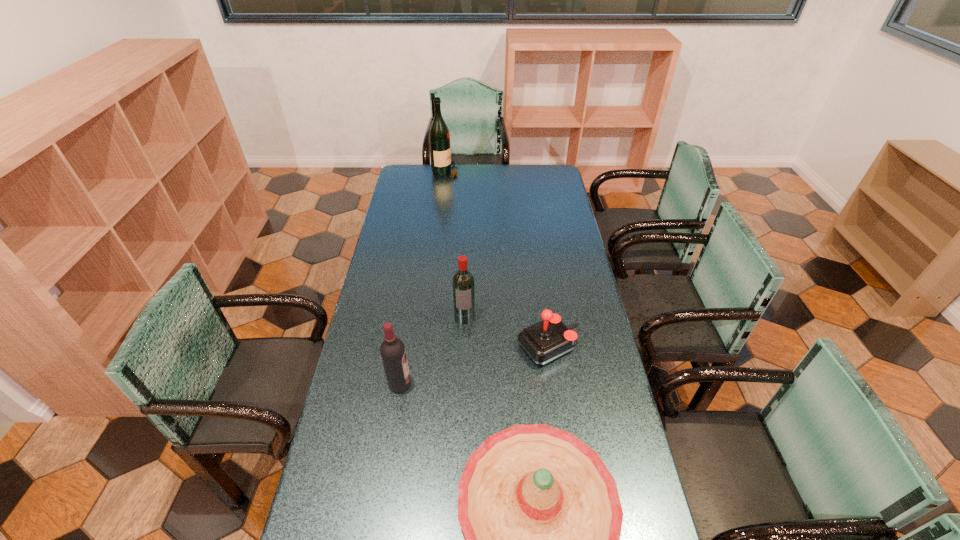
You are a GUI agent. You are given a task and a screenshot of the screen. Output one action in this format:
    pyautogui.click(x=<x>, y=<y>)
    Task: Click on the vacant space that is in between the joystick and the fourth nearest object
    The image size is (960, 540).
    Given the screenshot: What is the action you would take?
    pyautogui.click(x=507, y=332)

Image resolution: width=960 pixels, height=540 pixels. In order to click on free space between the second farthest object and the joystick in this screenshot , I will do `click(507, 332)`.

The height and width of the screenshot is (540, 960). Identify the location of empty space that is in between the joystick and the rightmost wine bottle. (507, 332).

Locate an element on the screen. free spot between the nearest wine bottle and the farthest object is located at coordinates (423, 278).

Identify the location of vacant region between the nearest wine bottle and the farthest object. The width and height of the screenshot is (960, 540). pos(423,278).

I want to click on free space that is in between the nearest wine bottle and the second nearest wine bottle, so click(x=432, y=350).

Choose which object is the second nearest neighbor to the nearest object. Please provide its 2D coordinates. Your answer should be formatted as a tuple, i.e. [(x, y)], where the tuple contains the x and y coordinates of a point satisfying the conditions above.

[(548, 339)]

Identify which object is the third nearest to the fourth farthest object. Please provide its 2D coordinates. Your answer should be formatted as a tuple, i.e. [(x, y)], where the tuple contains the x and y coordinates of a point satisfying the conditions above.

[(548, 339)]

Identify which wine bottle is the second nearest to the rightmost wine bottle. Please provide its 2D coordinates. Your answer should be formatted as a tuple, i.e. [(x, y)], where the tuple contains the x and y coordinates of a point satisfying the conditions above.

[(439, 137)]

Image resolution: width=960 pixels, height=540 pixels. What are the coordinates of `the second closest wine bottle relative to the rightmost wine bottle` in the screenshot? It's located at (439, 137).